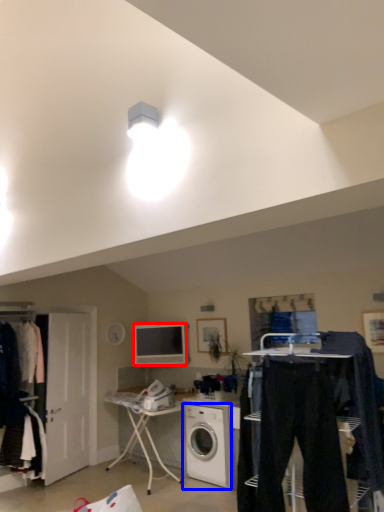
Question: Which of the following is the closest to the observer, television (highlighted by a red box) or washing machine (highlighted by a blue box)?

Choices:
 (A) television
 (B) washing machine

Answer: (B)